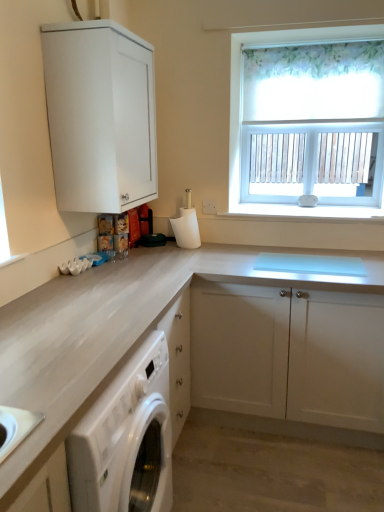
This screenshot has width=384, height=512. Identify the location of free point above white matte cabinet at center, the 1th cabinetry from the bottom (from a real-world perspective). (213, 258).